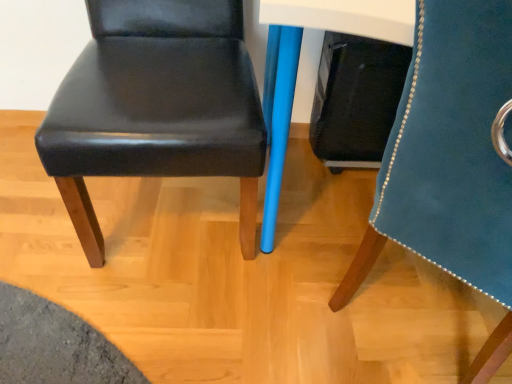
Question: Is black leather chair at center, the 1th chair when ordered from left to right, at the back of velvet blue chair at right, the first chair viewed from the right?

Choices:
 (A) yes
 (B) no

Answer: (B)

Question: Considering the relative sizes of velvet blue chair at right, the second chair when ordered from left to right, and black leather chair at center, placed as the 2th chair when sorted from right to left, in the image provided, is velvet blue chair at right, the second chair when ordered from left to right, smaller than black leather chair at center, placed as the 2th chair when sorted from right to left,?

Choices:
 (A) no
 (B) yes

Answer: (A)

Question: Is velvet blue chair at right, the first chair viewed from the right, outside black leather chair at center, placed as the 2th chair when sorted from right to left?

Choices:
 (A) no
 (B) yes

Answer: (B)

Question: Is velvet blue chair at right, the first chair viewed from the right, thinner than black leather chair at center, placed as the 2th chair when sorted from right to left?

Choices:
 (A) no
 (B) yes

Answer: (A)

Question: Is velvet blue chair at right, the second chair when ordered from left to right, shorter than black leather chair at center, placed as the 2th chair when sorted from right to left?

Choices:
 (A) yes
 (B) no

Answer: (B)

Question: Can you confirm if velvet blue chair at right, the second chair when ordered from left to right, is wider than black leather chair at center, placed as the 2th chair when sorted from right to left?

Choices:
 (A) yes
 (B) no

Answer: (A)

Question: Is black leather chair at center, placed as the 2th chair when sorted from right to left, behind velvet blue chair at right, the first chair viewed from the right?

Choices:
 (A) yes
 (B) no

Answer: (A)

Question: Does black leather chair at center, placed as the 2th chair when sorted from right to left, have a greater height compared to velvet blue chair at right, the first chair viewed from the right?

Choices:
 (A) yes
 (B) no

Answer: (B)

Question: Is black leather chair at center, the 1th chair when ordered from left to right, outside velvet blue chair at right, the second chair when ordered from left to right?

Choices:
 (A) no
 (B) yes

Answer: (B)

Question: Considering the relative sizes of black leather chair at center, placed as the 2th chair when sorted from right to left, and velvet blue chair at right, the second chair when ordered from left to right, in the image provided, is black leather chair at center, placed as the 2th chair when sorted from right to left, bigger than velvet blue chair at right, the second chair when ordered from left to right,?

Choices:
 (A) no
 (B) yes

Answer: (A)

Question: From the image's perspective, is black leather chair at center, placed as the 2th chair when sorted from right to left, over velvet blue chair at right, the first chair viewed from the right?

Choices:
 (A) no
 (B) yes

Answer: (B)

Question: Does black leather chair at center, placed as the 2th chair when sorted from right to left, turn towards velvet blue chair at right, the first chair viewed from the right?

Choices:
 (A) yes
 (B) no

Answer: (B)

Question: Considering the positions of black leather chair at center, the 1th chair when ordered from left to right, and velvet blue chair at right, the second chair when ordered from left to right, in the image, is black leather chair at center, the 1th chair when ordered from left to right, taller or shorter than velvet blue chair at right, the second chair when ordered from left to right,?

Choices:
 (A) short
 (B) tall

Answer: (A)